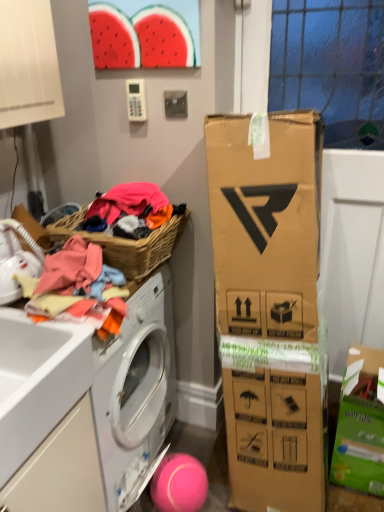
In order to click on woven brown picnic basket at left in this screenshot , I will do `click(126, 244)`.

The image size is (384, 512). I want to click on pink rubber ball at lower center, so click(x=179, y=484).

I want to click on ball below the woven brown picnic basket at left (from the image's perspective), so click(x=179, y=484).

Is pink rubber ball at lower center inside or outside of woven brown picnic basket at left?

pink rubber ball at lower center exists outside the volume of woven brown picnic basket at left.

Is pink rubber ball at lower center oriented towards woven brown picnic basket at left?

No, pink rubber ball at lower center is not turned towards woven brown picnic basket at left.

From the picture: Considering the sizes of objects woven brown picnic basket at left and cardboard box at lower right in the image provided, who is bigger, woven brown picnic basket at left or cardboard box at lower right?

Bigger between the two is cardboard box at lower right.

Considering the points (149, 257) and (349, 354), which point is behind, point (149, 257) or point (349, 354)?

Point (349, 354)

Considering the positions of objects woven brown picnic basket at left and cardboard box at lower right in the image provided, who is more to the left, woven brown picnic basket at left or cardboard box at lower right?

From the viewer's perspective, woven brown picnic basket at left appears more on the left side.

From the picture: Between woven brown picnic basket at left and cardboard box at lower right, which one has larger width?

With larger width is woven brown picnic basket at left.

Between cardboard box at lower right and white matte drawer at lower left, which one has more height?

white matte drawer at lower left.

From a real-world perspective, which object rests below the other?

cardboard box at lower right, from a real-world perspective.

This screenshot has height=512, width=384. I want to click on cardboard box below the white matte drawer at lower left (from a real-world perspective), so click(360, 425).

Can you confirm if cardboard box at lower right is bigger than white matte drawer at lower left?

No, cardboard box at lower right is not bigger than white matte drawer at lower left.

Considering the positions of objects woven brown picnic basket at left and white matte drawer at lower left in the image provided, who is more to the right, woven brown picnic basket at left or white matte drawer at lower left?

From the viewer's perspective, woven brown picnic basket at left appears more on the right side.

From a real-world perspective, which is physically below, woven brown picnic basket at left or white matte drawer at lower left?

white matte drawer at lower left, from a real-world perspective.

You are a GUI agent. You are given a task and a screenshot of the screen. Output one action in this format:
    pyautogui.click(x=<x>, y=<y>)
    Task: Click on the drawer in front of the woven brown picnic basket at left
    
    Given the screenshot: What is the action you would take?
    pyautogui.click(x=61, y=469)

Considering the sizes of woven brown picnic basket at left and white matte drawer at lower left in the image, is woven brown picnic basket at left wider or thinner than white matte drawer at lower left?

woven brown picnic basket at left is thinner than white matte drawer at lower left.

Can you confirm if white matte drawer at lower left is wider than woven brown picnic basket at left?

Yes, white matte drawer at lower left is wider than woven brown picnic basket at left.

From a real-world perspective, is white matte drawer at lower left positioned under woven brown picnic basket at left based on gravity?

Yes, from a real-world perspective, white matte drawer at lower left is under woven brown picnic basket at left.

Which is more to the left, white matte drawer at lower left or woven brown picnic basket at left?

white matte drawer at lower left is more to the left.

Between point (32, 500) and point (128, 266), which one is positioned behind?

The point (128, 266) is more distant.

Based on the photo, does white matte drawer at lower left contain pink rubber ball at lower center?

No, pink rubber ball at lower center is located outside of white matte drawer at lower left.

Is point (24, 472) positioned behind point (177, 458)?

That is False.

Consider the image. Between white matte drawer at lower left and pink rubber ball at lower center, which one has more height?

With more height is white matte drawer at lower left.

From a real-world perspective, who is located higher, white matte drawer at lower left or pink rubber ball at lower center?

In real-world perspective, white matte drawer at lower left is above.

Is cardboard box at lower right oriented away from pink rubber ball at lower center?

No, cardboard box at lower right is not facing away from pink rubber ball at lower center.

How different are the orientations of cardboard box at lower right and pink rubber ball at lower center in degrees?

They differ by 2.24 degrees in their facing directions.

From a real-world perspective, is cardboard box at lower right on top of pink rubber ball at lower center?

Correct, in the physical world, cardboard box at lower right is higher than pink rubber ball at lower center.

Identify the location of ball behind the cardboard box at lower right. Image resolution: width=384 pixels, height=512 pixels. (179, 484).

Where is `picnic basket in front of the pink rubber ball at lower center`? This screenshot has width=384, height=512. picnic basket in front of the pink rubber ball at lower center is located at coordinates coord(126,244).

This screenshot has height=512, width=384. Identify the location of picnic basket above the cardboard box at lower right (from the image's perspective). (126, 244).

Based on the photo, based on their spatial positions, is pink rubber ball at lower center or soft cotton clothes at left closer to cardboard box at lower right?

pink rubber ball at lower center lies closer to cardboard box at lower right than the other object.

Looking at the image, which one is located closer to woven brown picnic basket at left, white matte drawer at lower left or pink rubber ball at lower center?

white matte drawer at lower left is positioned closer to the anchor woven brown picnic basket at left.

Looking at the image, which one is located closer to pink rubber ball at lower center, woven brown picnic basket at left or soft cotton clothes at left?

Based on the image, soft cotton clothes at left appears to be nearer to pink rubber ball at lower center.

Which object lies further to the anchor point soft cotton clothes at left, woven brown picnic basket at left or pink rubber ball at lower center?

pink rubber ball at lower center is positioned further to the anchor soft cotton clothes at left.

Looking at this image, which object lies nearer to the anchor point white matte drawer at lower left, woven brown picnic basket at left or cardboard box at lower right?

woven brown picnic basket at left.

Estimate the real-world distances between objects in this image. Which object is further from cardboard box at lower right, woven brown picnic basket at left or soft cotton clothes at left?

soft cotton clothes at left.

Consider the image. From the image, which object appears to be nearer to pink rubber ball at lower center, white matte drawer at lower left or soft cotton clothes at left?

white matte drawer at lower left is closer to pink rubber ball at lower center.

From the image, which object appears to be nearer to pink rubber ball at lower center, soft cotton clothes at left or cardboard box at lower right?

Among the two, cardboard box at lower right is located nearer to pink rubber ball at lower center.

This screenshot has height=512, width=384. I want to click on picnic basket between soft cotton clothes at left and cardboard box at lower right in the horizontal direction, so (126, 244).

Identify the location of cardboard box between woven brown picnic basket at left and pink rubber ball at lower center vertically. The height and width of the screenshot is (512, 384). (360, 425).

Where is `ball between soft cotton clothes at left and cardboard box at lower right`? ball between soft cotton clothes at left and cardboard box at lower right is located at coordinates (179, 484).

This screenshot has width=384, height=512. I want to click on ball between white matte drawer at lower left and cardboard box at lower right, so click(x=179, y=484).